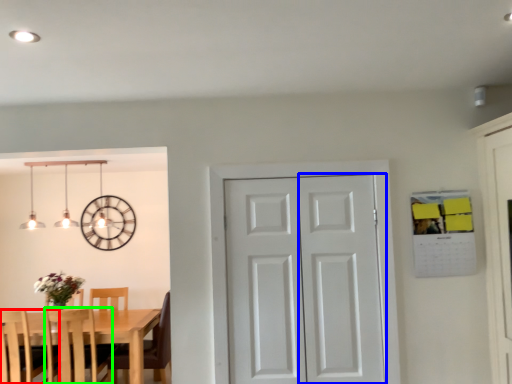
Question: Estimate the real-world distances between objects in this image. Which object is farther from chair (highlighted by a red box), screen door (highlighted by a blue box) or chair (highlighted by a green box)?

Choices:
 (A) screen door
 (B) chair

Answer: (A)